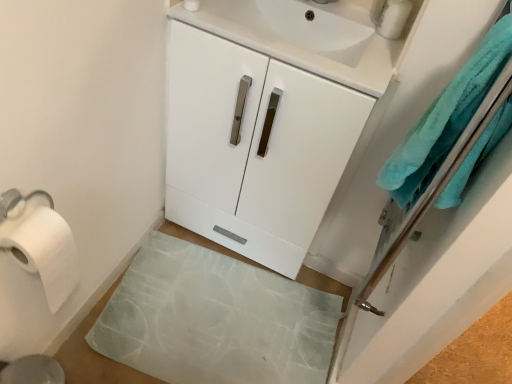
Question: Does teal soft towel at right come behind metallic silver soap dispenser at upper right?

Choices:
 (A) yes
 (B) no

Answer: (B)

Question: Is teal soft towel at right looking in the opposite direction of metallic silver soap dispenser at upper right?

Choices:
 (A) yes
 (B) no

Answer: (B)

Question: From the image's perspective, does teal soft towel at right appear higher than metallic silver soap dispenser at upper right?

Choices:
 (A) yes
 (B) no

Answer: (B)

Question: Is teal soft towel at right next to metallic silver soap dispenser at upper right?

Choices:
 (A) no
 (B) yes

Answer: (A)

Question: Is teal soft towel at right closer to camera compared to metallic silver soap dispenser at upper right?

Choices:
 (A) yes
 (B) no

Answer: (A)

Question: Is teal soft towel at right completely or partially outside of metallic silver soap dispenser at upper right?

Choices:
 (A) no
 (B) yes

Answer: (B)

Question: From the image's perspective, is white glossy cabinet at center located beneath teal soft towel at right?

Choices:
 (A) yes
 (B) no

Answer: (B)

Question: Is white glossy cabinet at center thinner than teal soft towel at right?

Choices:
 (A) no
 (B) yes

Answer: (A)

Question: Is white glossy cabinet at center to the left of teal soft towel at right from the viewer's perspective?

Choices:
 (A) yes
 (B) no

Answer: (A)

Question: From the image's perspective, would you say white glossy cabinet at center is positioned over teal soft towel at right?

Choices:
 (A) yes
 (B) no

Answer: (A)

Question: Is white glossy cabinet at center not near teal soft towel at right?

Choices:
 (A) no
 (B) yes

Answer: (A)

Question: Is white glossy cabinet at center turned away from teal soft towel at right?

Choices:
 (A) no
 (B) yes

Answer: (A)

Question: Is teal soft towel at right to the left of white glossy cabinet at center from the viewer's perspective?

Choices:
 (A) no
 (B) yes

Answer: (A)